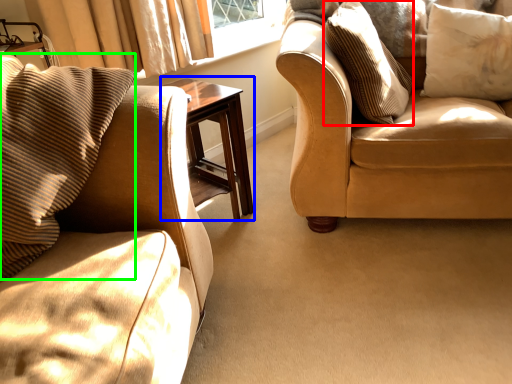
Question: Estimate the real-world distances between objects in this image. Which object is closer to pillow (highlighted by a red box), table (highlighted by a blue box) or pillow (highlighted by a green box)?

Choices:
 (A) table
 (B) pillow

Answer: (A)